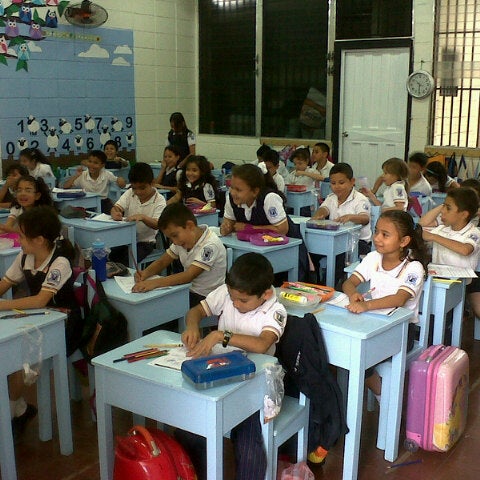
Where is `pencil box`? This screenshot has width=480, height=480. pencil box is located at coordinates (265, 236), (327, 226), (212, 367), (197, 207), (298, 187).